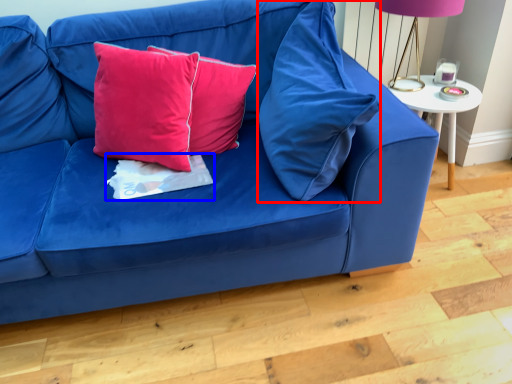
Question: Which object appears closest to the camera in this image, pillow (highlighted by a red box) or sheet (highlighted by a blue box)?

Choices:
 (A) pillow
 (B) sheet

Answer: (A)